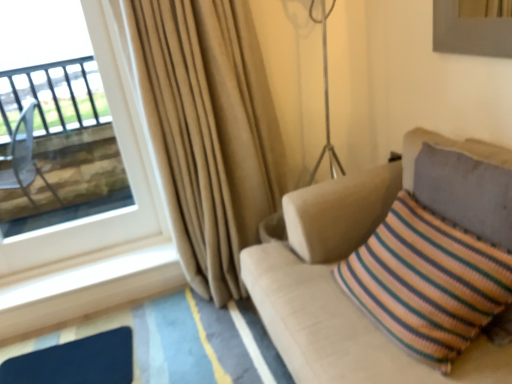
Question: Is beige fabric couch at right to the left or to the right of transparent glass window at upper left in the image?

Choices:
 (A) left
 (B) right

Answer: (B)

Question: Choose the correct answer: Is beige fabric couch at right inside transparent glass window at upper left or outside it?

Choices:
 (A) inside
 (B) outside

Answer: (B)

Question: Estimate the real-world distances between objects in this image. Which object is closer to the beige fabric couch at right?

Choices:
 (A) transparent glass window at upper left
 (B) beige fabric curtain at left
 (C) matte blue mat at lower left

Answer: (B)

Question: Which of these objects is positioned farthest from the transparent glass window at upper left?

Choices:
 (A) matte blue mat at lower left
 (B) beige fabric couch at right
 (C) beige fabric curtain at left

Answer: (B)